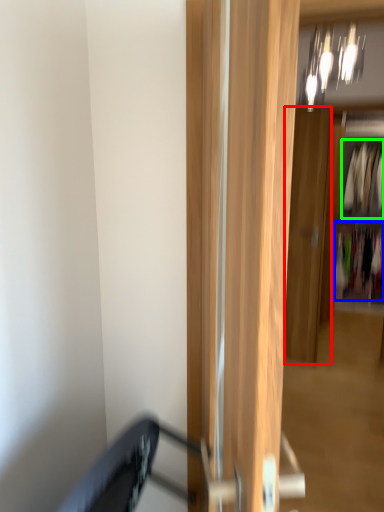
Question: Based on their relative distances, which object is farther from door (highlighted by a red box)? Choose from clothing (highlighted by a blue box) and clothing (highlighted by a green box).

Choices:
 (A) clothing
 (B) clothing

Answer: (B)